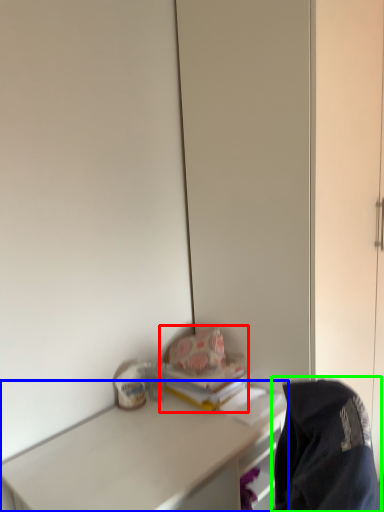
Question: Considering the real-world distances, which object is closest to book (highlighted by a red box)? desk (highlighted by a blue box) or jacket (highlighted by a green box).

Choices:
 (A) desk
 (B) jacket

Answer: (A)